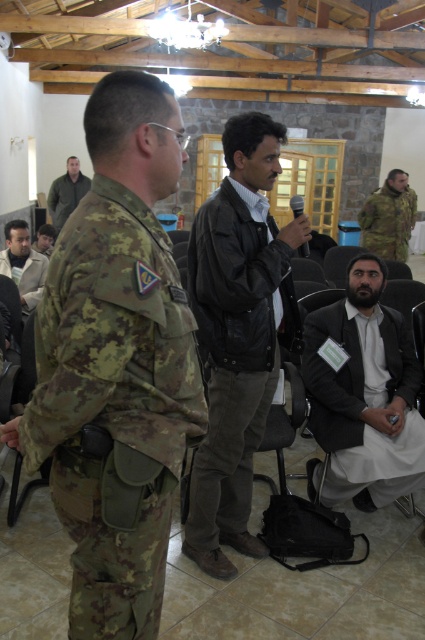
Question: Is camouflage fabric uniform at center above matte black jacket at center?

Choices:
 (A) no
 (B) yes

Answer: (B)

Question: Is black leather jacket at center to the right of matte black jacket at center from the viewer's perspective?

Choices:
 (A) no
 (B) yes

Answer: (B)

Question: Which object is closer to the camera taking this photo?

Choices:
 (A) black leather jacket at center
 (B) camouflage fabric uniform at center

Answer: (A)

Question: Does black leather jacket at center have a greater width compared to dark green leather jacket at upper left?

Choices:
 (A) no
 (B) yes

Answer: (A)

Question: Which of the following is the farthest from the observer?

Choices:
 (A) matte black jacket at center
 (B) light brown leather jacket at lower left

Answer: (A)

Question: Which point is closer to the camera?

Choices:
 (A) black leather jacket at center
 (B) camouflage fabric uniform at left
 (C) camouflage fabric uniform at center

Answer: (B)